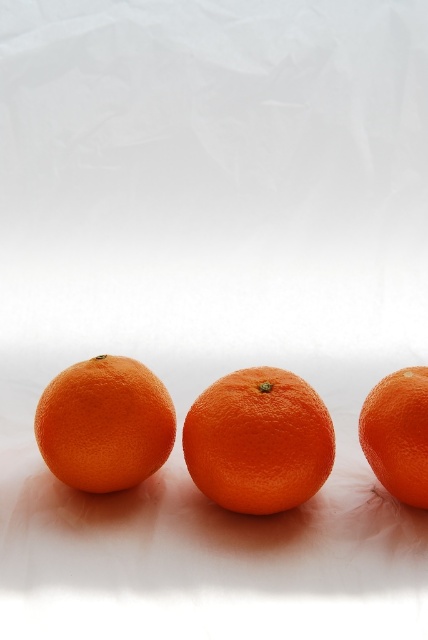
Question: Which point is closer to the camera?

Choices:
 (A) (388, 400)
 (B) (95, 449)
 (C) (258, 513)

Answer: (B)

Question: Which object is positioned closest to the orangesmoothorange at right?

Choices:
 (A) orange matte tangerine at center
 (B) orangesmoothorange at center

Answer: (B)

Question: Is orangesmoothorange at center smaller than orangesmoothorange at right?

Choices:
 (A) yes
 (B) no

Answer: (B)

Question: Where is orange matte tangerine at center located in relation to orangesmoothorange at right in the image?

Choices:
 (A) left
 (B) right

Answer: (A)

Question: Can you confirm if orangesmoothorange at center is positioned above orangesmoothorange at right?

Choices:
 (A) yes
 (B) no

Answer: (B)

Question: Which is farther from the orangesmoothorange at right?

Choices:
 (A) orange matte tangerine at center
 (B) orangesmoothorange at center

Answer: (A)